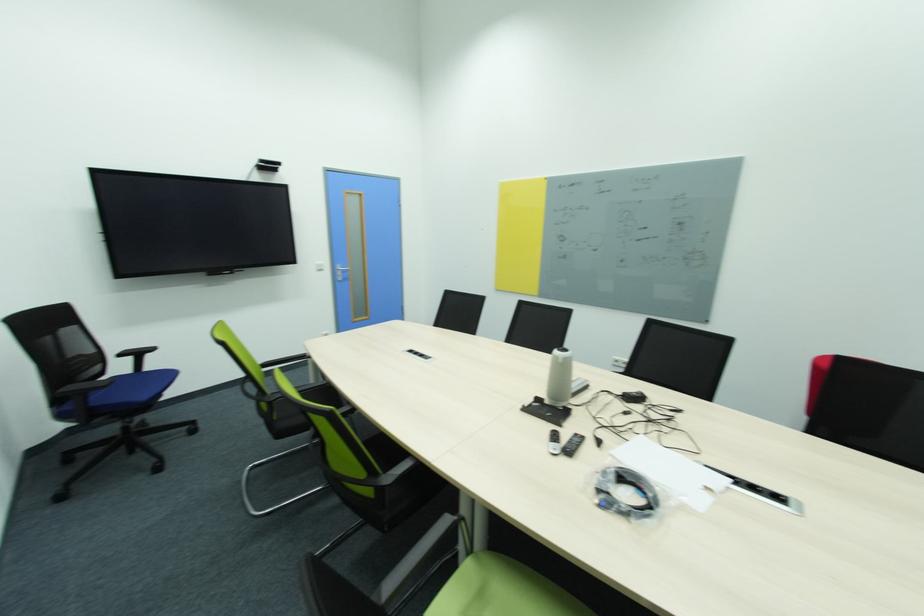
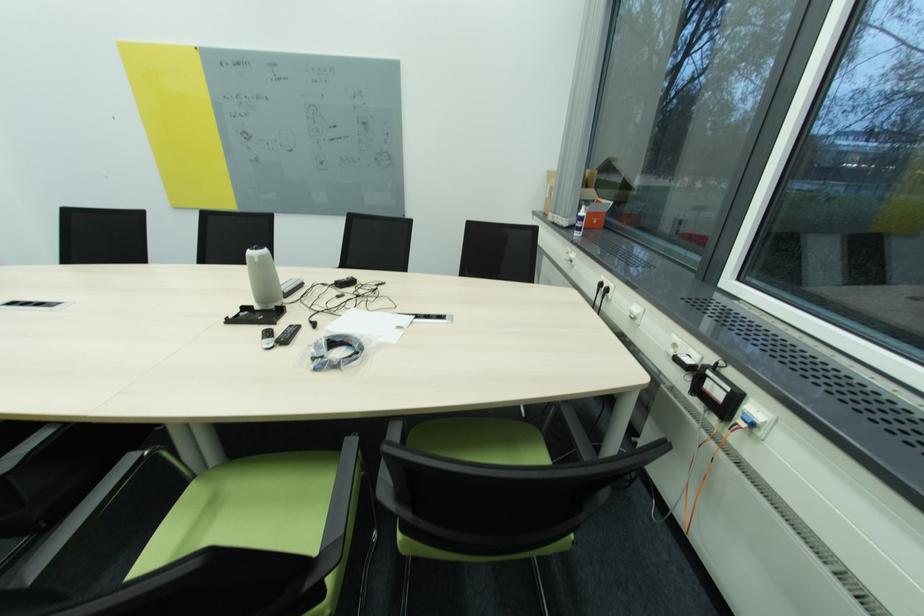
The point at (564, 362) is marked in the first image. Where is the corresponding point in the second image?

(261, 262)